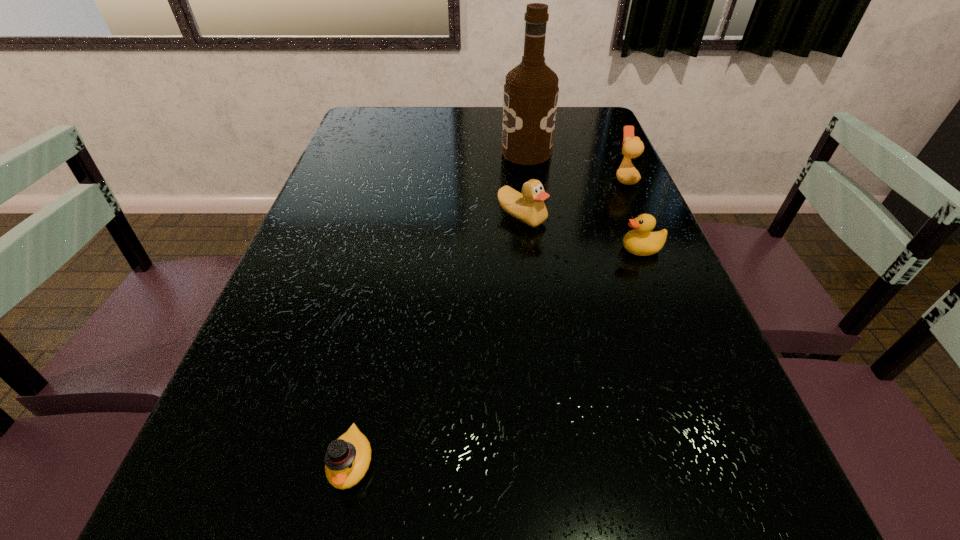
The image size is (960, 540). In order to click on vacant area that lies between the tallest object and the farthest duck in this screenshot , I will do `click(576, 166)`.

Where is `empty space between the nearest duck and the alcohol`? The width and height of the screenshot is (960, 540). empty space between the nearest duck and the alcohol is located at coordinates (439, 308).

I want to click on the third closest object to the third nearest duck, so click(x=627, y=174).

Locate which object is the second closest to the alcohol. Please provide its 2D coordinates. Your answer should be formatted as a tuple, i.e. [(x, y)], where the tuple contains the x and y coordinates of a point satisfying the conditions above.

[(529, 207)]

Locate an element on the screen. The image size is (960, 540). duck identified as the fourth closest to the alcohol is located at coordinates (347, 459).

Point out which duck is positioned as the nearest to the third nearest duck. Please provide its 2D coordinates. Your answer should be formatted as a tuple, i.e. [(x, y)], where the tuple contains the x and y coordinates of a point satisfying the conditions above.

[(640, 241)]

Find the location of `free region that satisfies the following two spatial constraints: 1. on the label of the tallest object; 2. at the beak of the third nearest object`. free region that satisfies the following two spatial constraints: 1. on the label of the tallest object; 2. at the beak of the third nearest object is located at coordinates (537, 217).

Where is `vacant space that satisfies the following two spatial constraints: 1. on the label of the tallest object; 2. at the beak of the third duck from right to left`? vacant space that satisfies the following two spatial constraints: 1. on the label of the tallest object; 2. at the beak of the third duck from right to left is located at coordinates (537, 217).

Find the location of a particular element. The width and height of the screenshot is (960, 540). vacant region that satisfies the following two spatial constraints: 1. at the beak of the fourth tallest object; 2. on the front-facing side of the shortest duck is located at coordinates (728, 463).

The width and height of the screenshot is (960, 540). I want to click on vacant space that satisfies the following two spatial constraints: 1. on the label of the tallest object; 2. on the front-facing side of the leftmost object, so tap(574, 463).